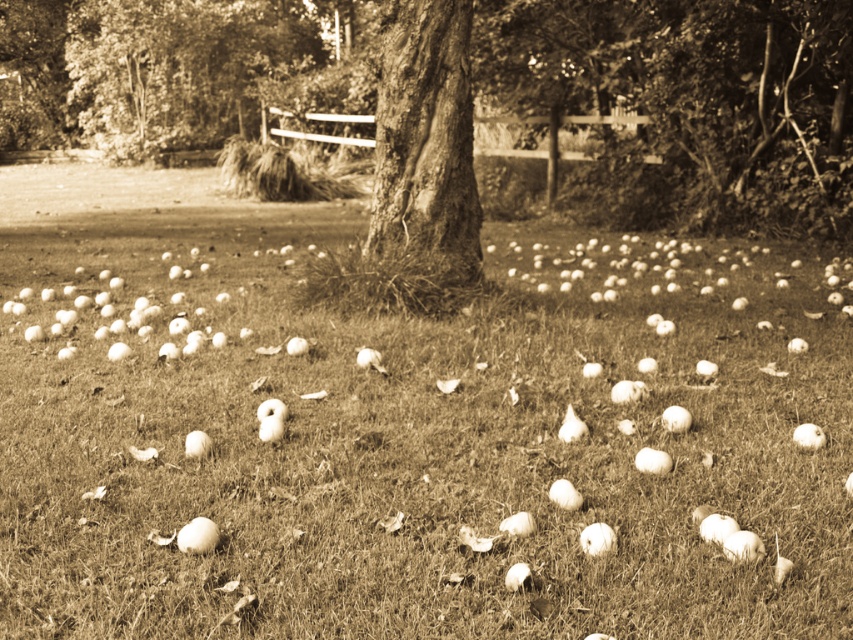
Question: Among these points, which one is farthest from the camera?

Choices:
 (A) (289, 592)
 (B) (461, 3)

Answer: (B)

Question: Which of the following is the closest to the observer?

Choices:
 (A) (86, 419)
 (B) (422, 125)

Answer: (A)

Question: Which point is closer to the camera?

Choices:
 (A) smooth bark tree at center
 (B) smooth grass at center

Answer: (B)

Question: Does smooth grass at center appear on the left side of smooth bark tree at center?

Choices:
 (A) yes
 (B) no

Answer: (A)

Question: Observing the image, what is the correct spatial positioning of smooth grass at center in reference to smooth bark tree at center?

Choices:
 (A) below
 (B) above

Answer: (A)

Question: Can you confirm if smooth grass at center is bigger than smooth bark tree at center?

Choices:
 (A) no
 (B) yes

Answer: (A)